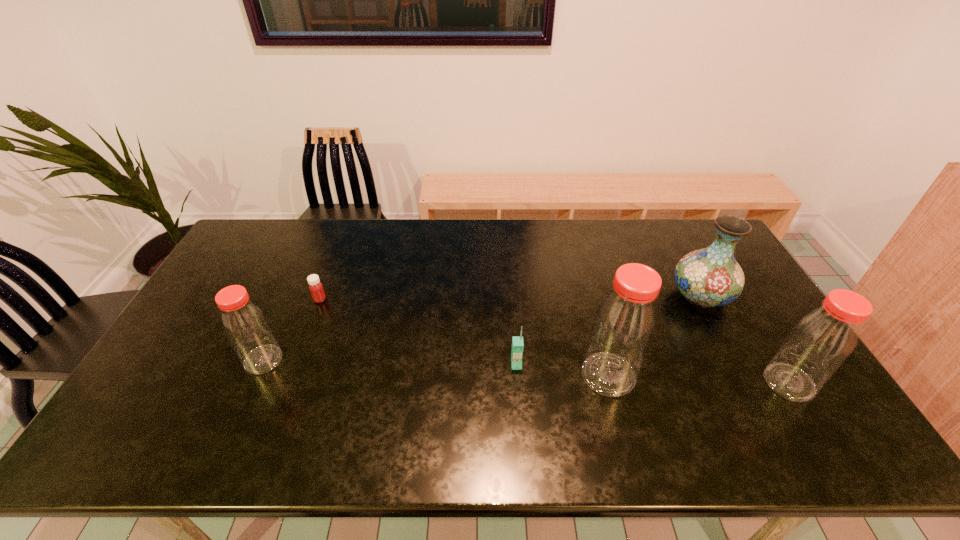
If equal spacing is desired by inserting an extra bottle among them, please point out a free spot for this new bottle. Please provide its 2D coordinates. Your answer should be formatted as a tuple, i.e. [(x, y)], where the tuple contains the x and y coordinates of a point satisfying the conditions above.

[(433, 367)]